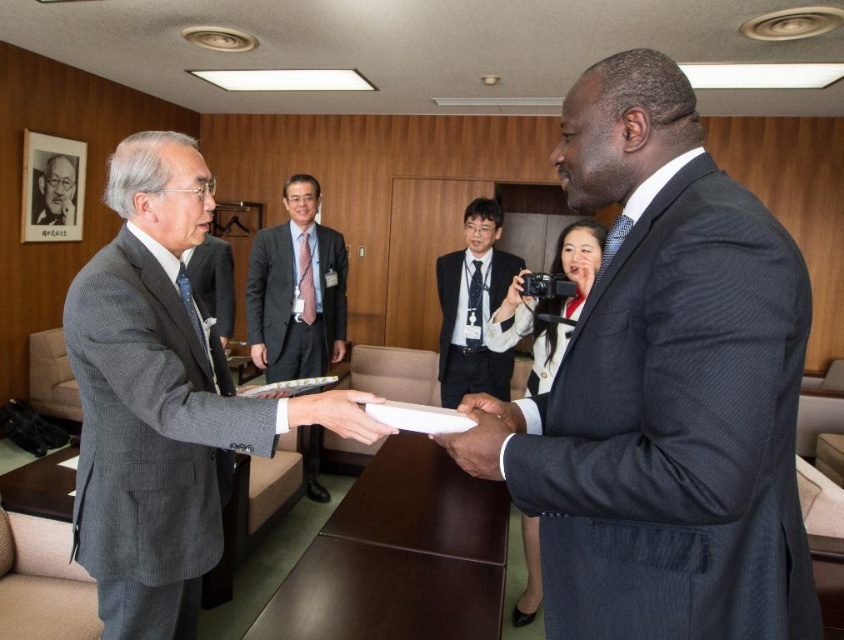
How far apart are dark blue suit at center and gray wool suit at center?

dark blue suit at center is 3.18 meters from gray wool suit at center.

Can you confirm if dark blue suit at center is shorter than gray wool suit at center?

In fact, dark blue suit at center may be taller than gray wool suit at center.

This screenshot has width=844, height=640. In order to click on dark blue suit at center in this screenshot , I will do `click(669, 388)`.

Between gray wool suit at left and matte gray suit at center, which one is positioned lower?

gray wool suit at left

Who is shorter, gray wool suit at left or matte gray suit at center?

matte gray suit at center is shorter.

Which is in front, point (180, 484) or point (318, 227)?

Positioned in front is point (180, 484).

Locate an element on the screen. The image size is (844, 640). gray wool suit at left is located at coordinates (153, 397).

Does matte gray suit at center appear under black matte hand at center?

Actually, matte gray suit at center is above black matte hand at center.

Between matte gray suit at center and black matte hand at center, which one appears on the left side from the viewer's perspective?

matte gray suit at center

Does point (317, 451) come closer to viewer compared to point (482, 404)?

No, (317, 451) is behind (482, 404).

Find the location of `matte gray suit at center`. matte gray suit at center is located at coordinates (296, 291).